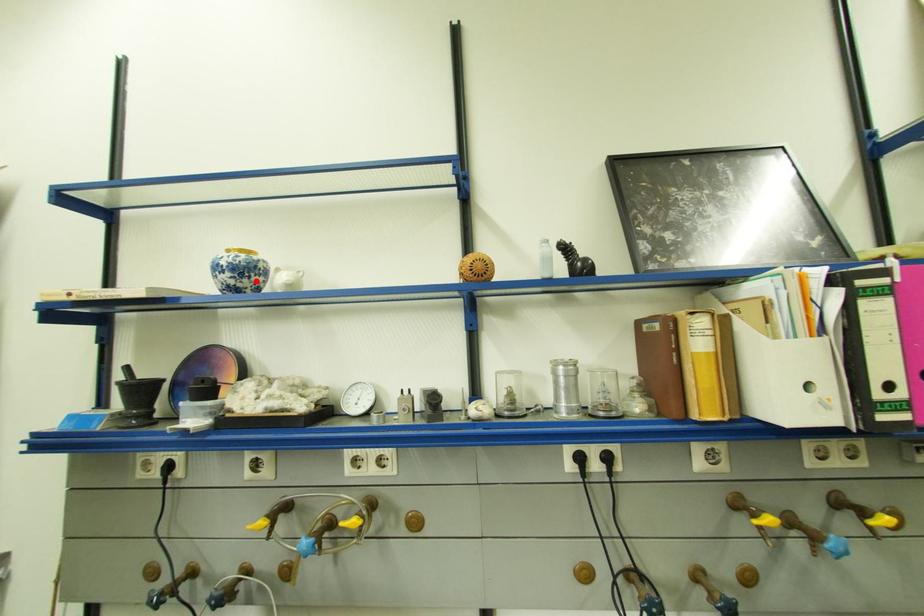
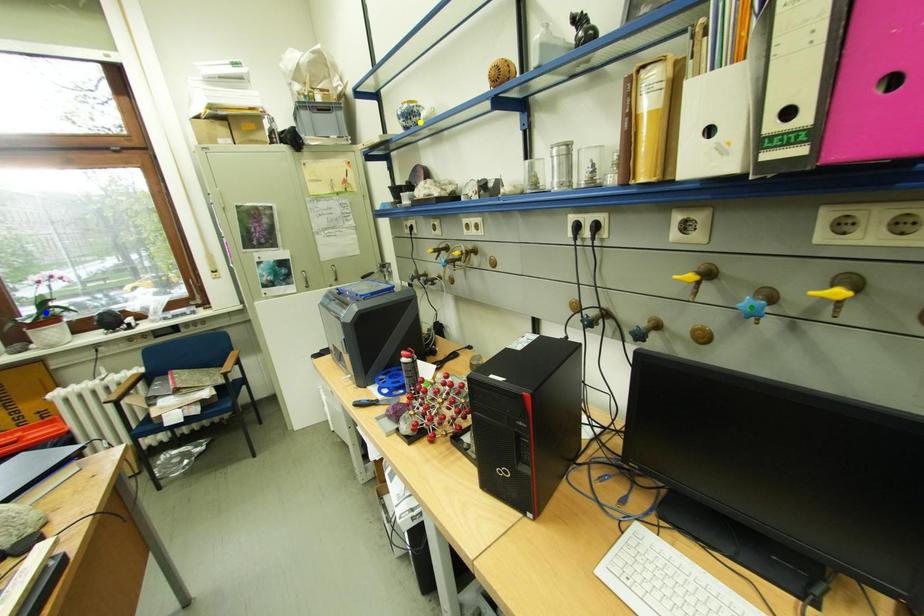
Question: I am providing you with two images of the same scene from different viewpoints. A red point is marked on the first image. You are given multiple points on the second image. Can you choose the point in image 2 that corresponds to the point in image 1?

Choices:
 (A) yellow point
 (B) green point
 (C) blue point

Answer: (A)